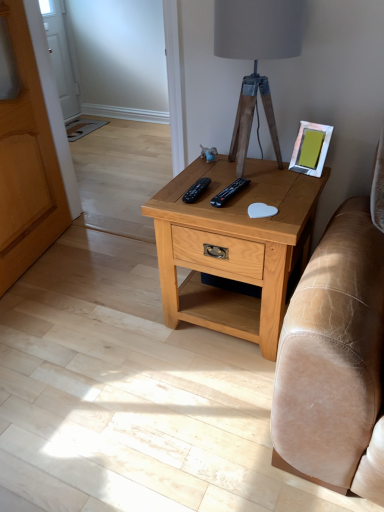
You are a GUI agent. You are given a task and a screenshot of the screen. Output one action in this format:
    pyautogui.click(x=<x>, y=<y>)
    Task: Click on the vacant space in front of wooden armoire at left
    The width and height of the screenshot is (384, 512).
    Given the screenshot: What is the action you would take?
    pyautogui.click(x=56, y=307)